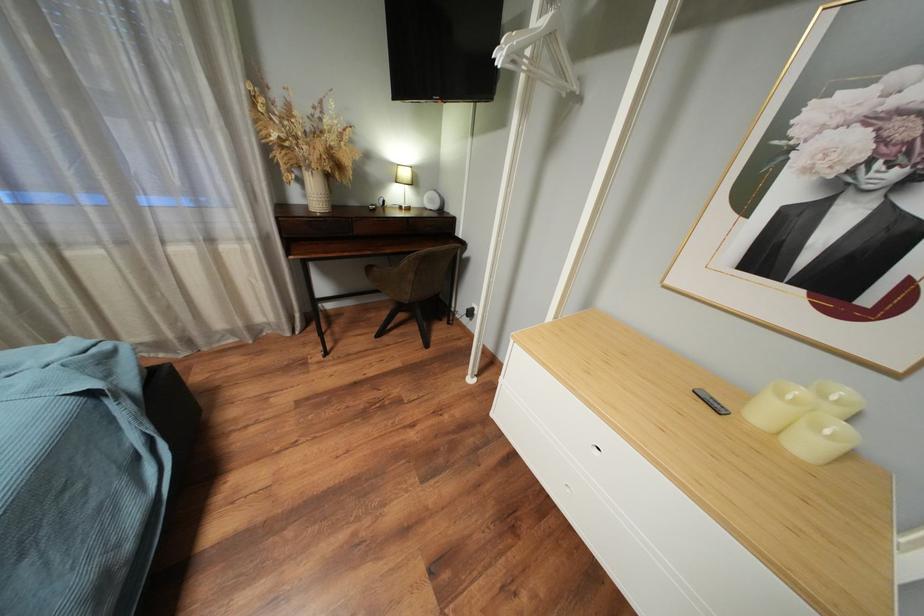
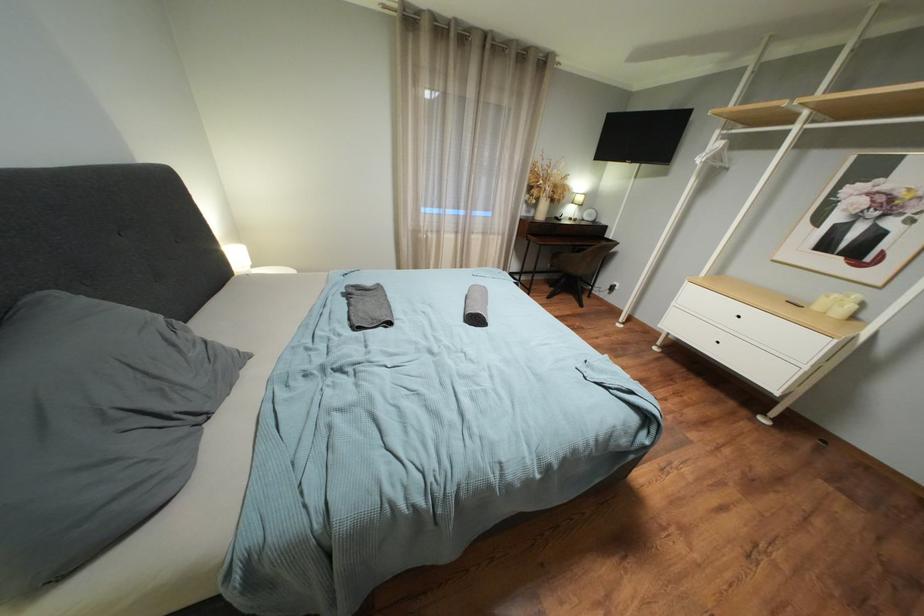
Which direction would the cameraman need to move to produce the second image?

The cameraman walked toward left, backward.